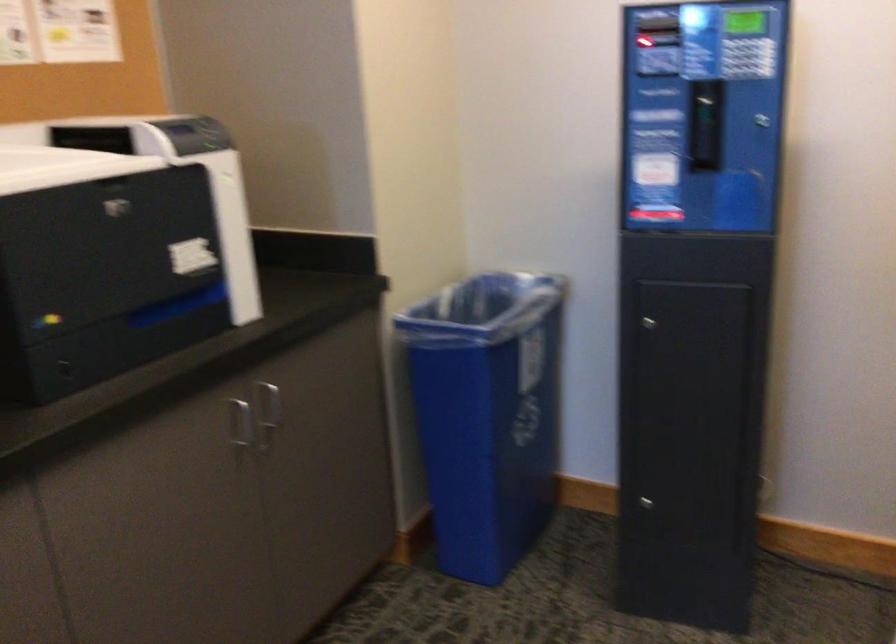
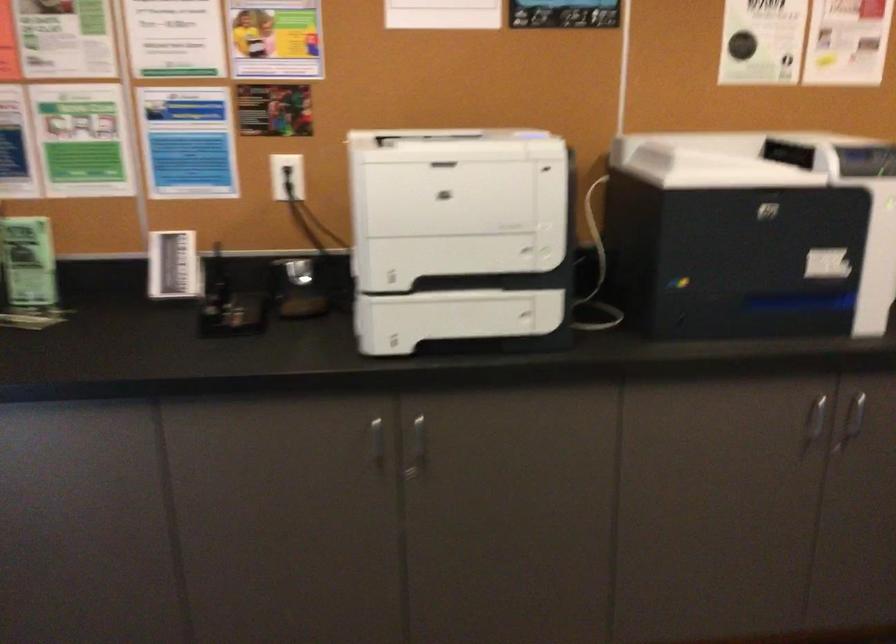
In the second image, find the point that corresponds to point (115, 274) in the first image.

(737, 259)